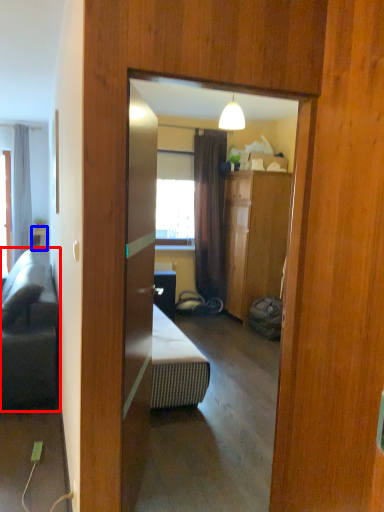
Question: Among these objects, which one is nearest to the camera, studio couch (highlighted by a red box) or table (highlighted by a blue box)?

Choices:
 (A) studio couch
 (B) table

Answer: (A)